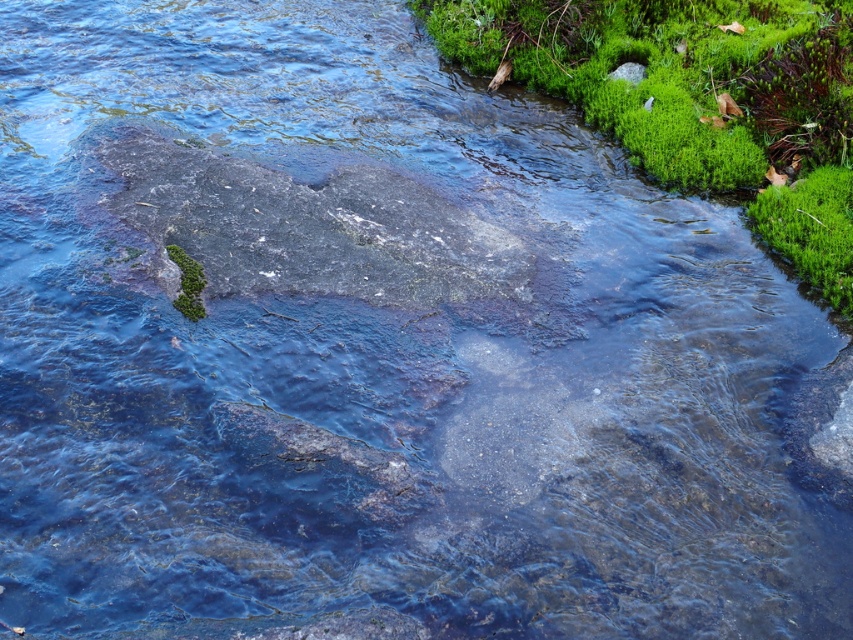
Does green mossy algae at upper right appear on the right side of green mossy rock at lower left?

Yes, green mossy algae at upper right is to the right of green mossy rock at lower left.

The width and height of the screenshot is (853, 640). What do you see at coordinates (697, 99) in the screenshot?
I see `green mossy algae at upper right` at bounding box center [697, 99].

Where is `green mossy algae at upper right`? The height and width of the screenshot is (640, 853). green mossy algae at upper right is located at coordinates [x=697, y=99].